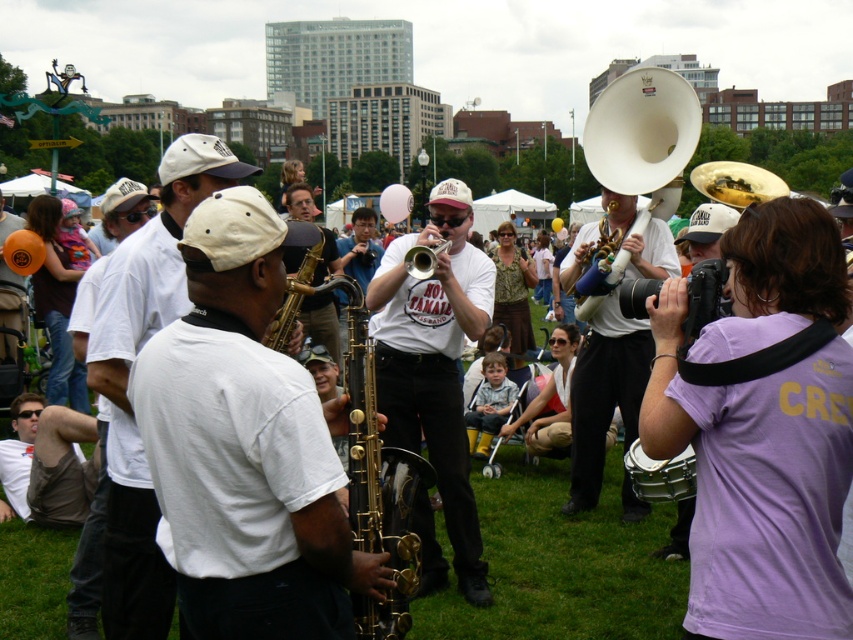
Is point (312, 205) positioned in front of point (683, 477)?

No, it is not.

Which is more to the right, gold shiny saxophone at center or metallic silver drum at lower right?

metallic silver drum at lower right

Is point (297, 182) more distant than point (680, 490)?

Yes, point (297, 182) is behind point (680, 490).

You are a GUI agent. You are given a task and a screenshot of the screen. Output one action in this format:
    pyautogui.click(x=<x>, y=<y>)
    Task: Click on the gold shiny saxophone at center
    The width and height of the screenshot is (853, 640).
    Given the screenshot: What is the action you would take?
    pyautogui.click(x=321, y=321)

Between white matte saxophone at center and gold brass saxophone at center, which one has less height?

With less height is gold brass saxophone at center.

Find the location of a particular element. white matte saxophone at center is located at coordinates (247, 444).

Between matte gold tuba at center and brushed brass trumpet at center, which one is positioned higher?

brushed brass trumpet at center is higher up.

In the scene shown: Is matte gold tuba at center bigger than brushed brass trumpet at center?

Yes, matte gold tuba at center is bigger than brushed brass trumpet at center.

Does point (612, 330) come behind point (427, 268)?

Yes, point (612, 330) is behind point (427, 268).

The height and width of the screenshot is (640, 853). In order to click on matte gold tuba at center in this screenshot , I will do `click(604, 394)`.